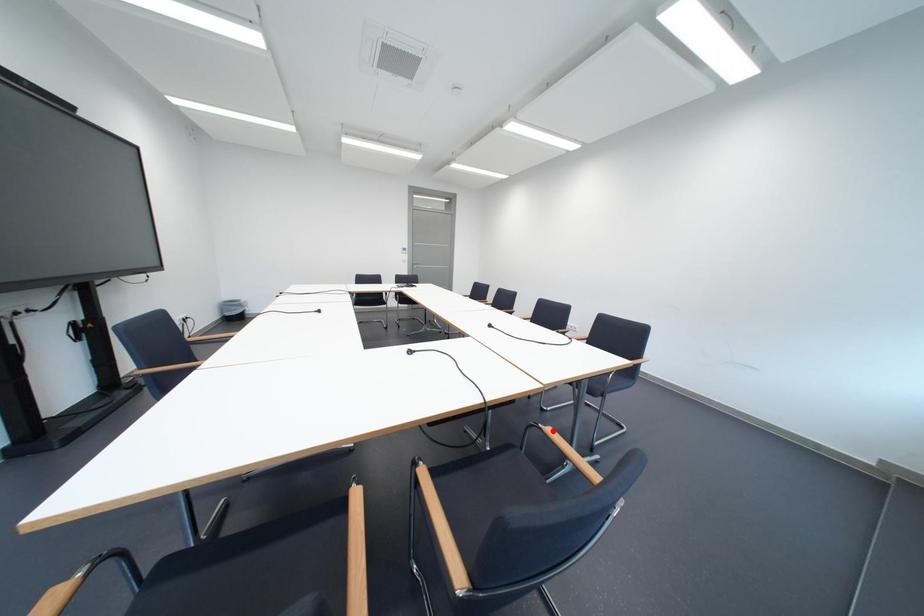
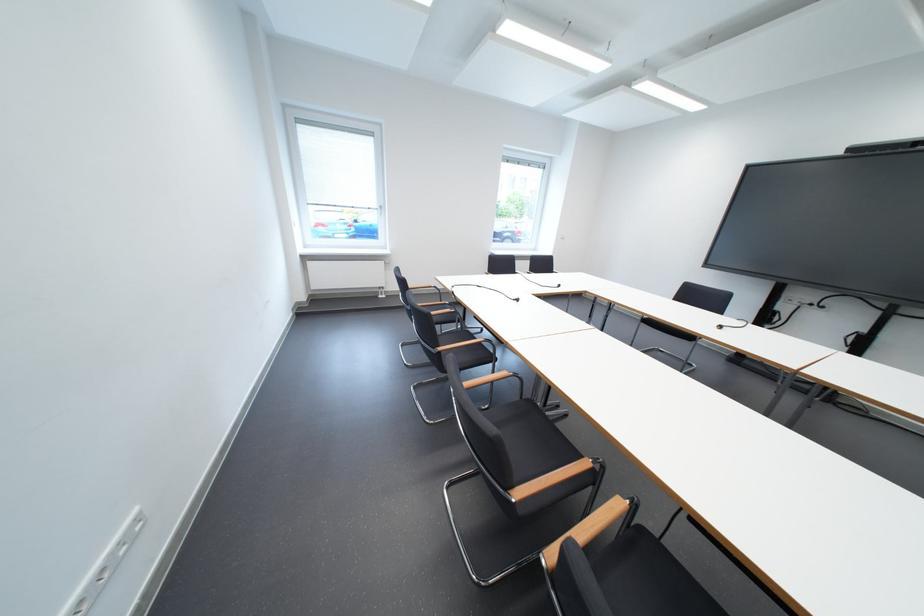
Question: I am providing you with two images of the same scene from different viewpoints. A red point is marked on the first image. At the location where the point appears in image 1, is it still visible in image 2?

Choices:
 (A) Yes
 (B) No

Answer: (B)